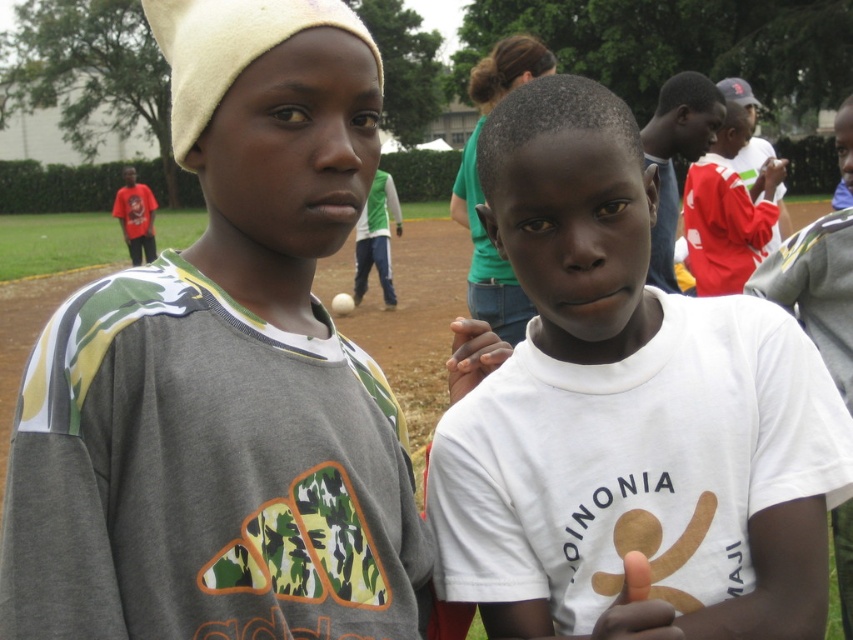
Measure the distance between smooth brown hand at center and camera.

They are 1.18 meters apart.

Can you confirm if smooth brown hand at center is smaller than white matte baseball at center?

Correct, smooth brown hand at center occupies less space than white matte baseball at center.

Who is more distant from viewer, (610, 608) or (347, 305)?

The point (347, 305) is behind.

Identify the location of smooth brown hand at center. [636, 608].

Who is shorter, red cotton shirt at upper right or smooth brown hand at center?

With less height is smooth brown hand at center.

Is red cotton shirt at upper right thinner than smooth brown hand at center?

No.

Is point (666, 200) positioned behind point (601, 637)?

Yes, it is.

Identify the location of red cotton shirt at upper right. This screenshot has width=853, height=640. (676, 154).

Who is positioned more to the left, smooth white hand at center or white matte baseball at center?

white matte baseball at center is more to the left.

Is smooth white hand at center smaller than white matte baseball at center?

Indeed, smooth white hand at center has a smaller size compared to white matte baseball at center.

Is point (467, 340) less distant than point (345, 314)?

Yes, point (467, 340) is closer to viewer.

Locate an element on the screen. The image size is (853, 640). smooth white hand at center is located at coordinates (473, 355).